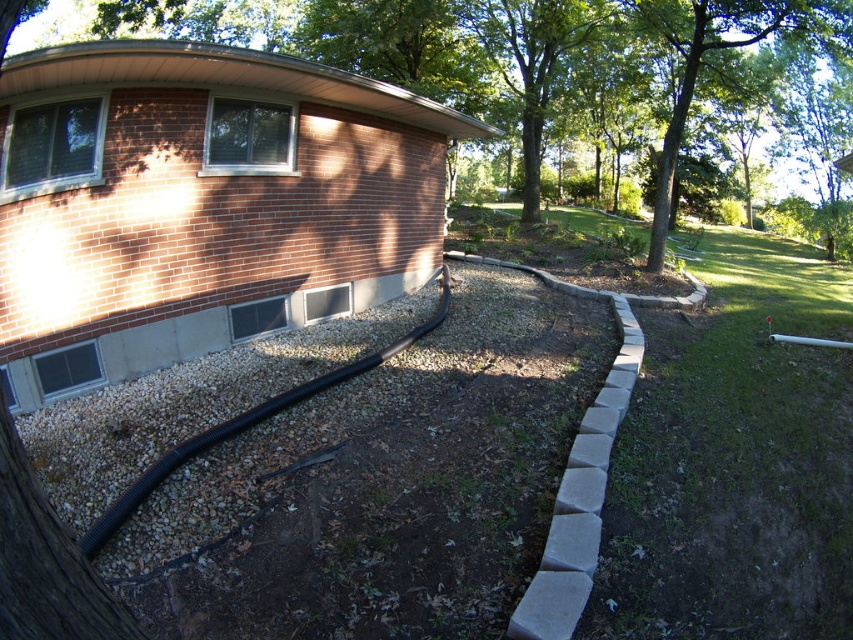
You are a gardener who needs to place a small potted plant between the gray gravel at lower left and the black rubber garden hose at lower left. Which object should you place the plant closer to if you want it to be near the smaller material?

The gray gravel at lower left is smaller than the black rubber garden hose at lower left, so you should place the plant closer to the gray gravel at lower left.

You are standing at the center of the backyard and want to plant a new tree exactly where the green leafy tree at upper right is currently located. Given that the coordinates of the center of the backyard are at point 0.5, 0.5, can you determine the direction you need to walk to reach the desired planting spot?

The green leafy tree at upper right is located at point (723, 49). Since the center of the backyard is at (426, 320), you need to move towards the northwest direction to reach the desired planting spot.